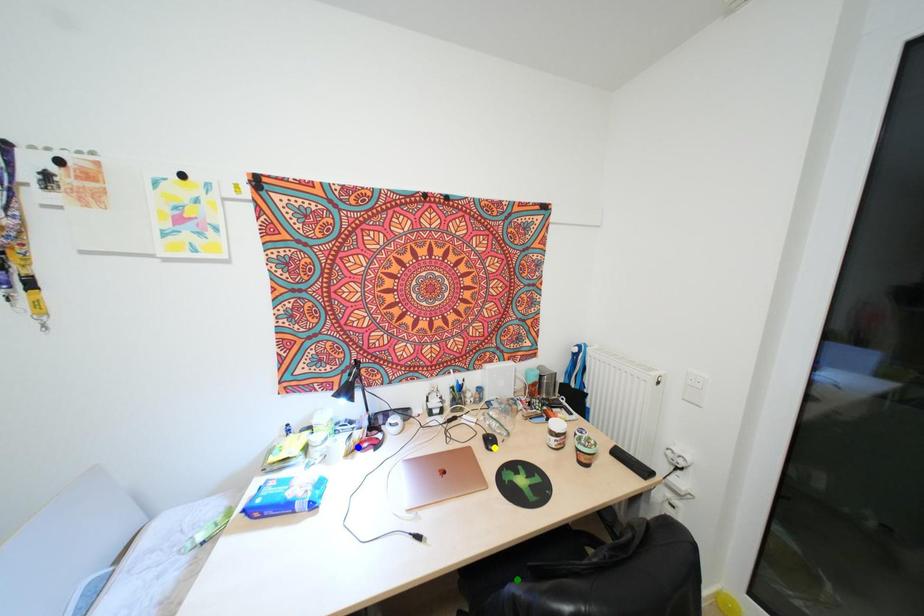
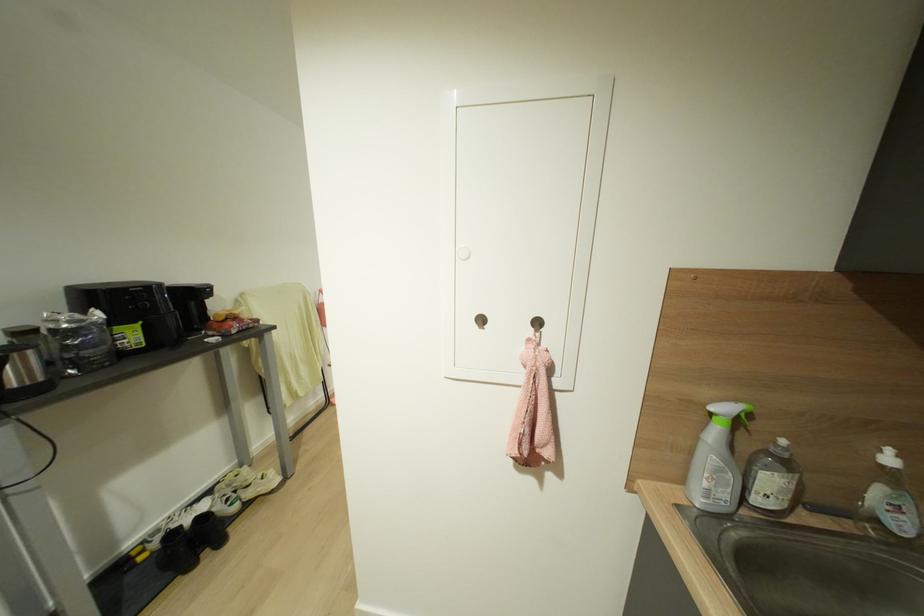
I am providing you with two images of the same scene from different viewpoints. Three points are marked in image1. Which point corresponds to a part or object that is occluded in image2?In image1, three points are marked. Which of them correspond to a part or object that is occluded in image2?Among the three points shown in image1, which one corresponds to a part or object that is no longer visible due to occlusion in image2?

Invisible in image2: green point, blue point, yellow point.